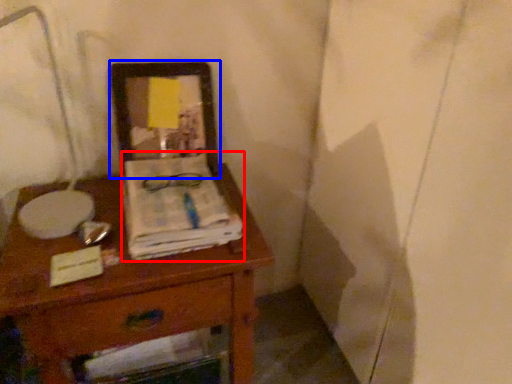
Question: Which object is closer to the camera taking this photo, magazine (highlighted by a red box) or picture frame (highlighted by a blue box)?

Choices:
 (A) magazine
 (B) picture frame

Answer: (A)